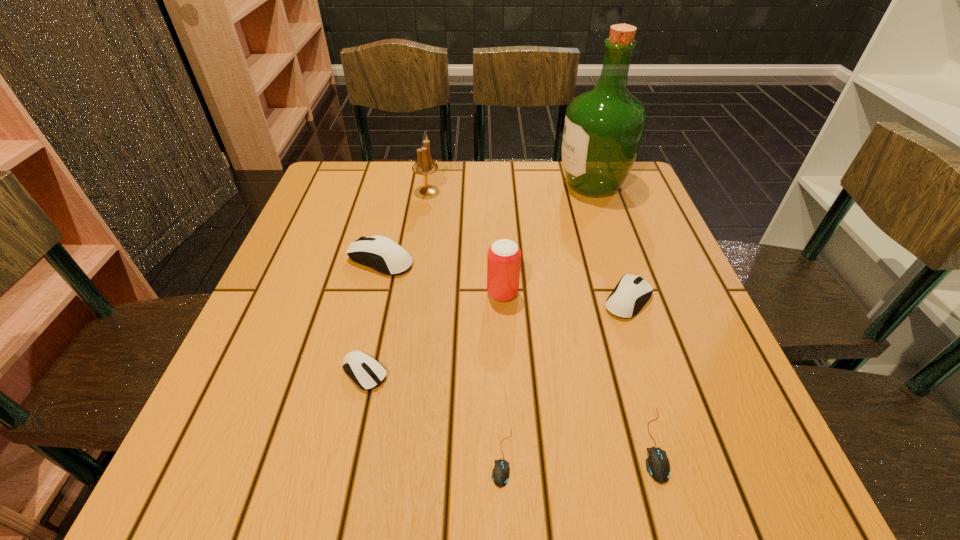
You are a GUI agent. You are given a task and a screenshot of the screen. Output one action in this format:
    pyautogui.click(x=<x>, y=<y>)
    Task: Click on the third nearest mouse
    
    Given the screenshot: What is the action you would take?
    pyautogui.click(x=367, y=373)

The image size is (960, 540). Identify the location of the seventh tallest object. (657, 464).

The height and width of the screenshot is (540, 960). In order to click on the right black mouse in this screenshot , I will do `click(657, 464)`.

Locate an element on the screen. This screenshot has height=540, width=960. the left black mouse is located at coordinates (500, 474).

This screenshot has height=540, width=960. In order to click on the shortest object in this screenshot , I will do `click(500, 474)`.

Where is `vacant space located on the front-facing side of the tallest object`? This screenshot has height=540, width=960. vacant space located on the front-facing side of the tallest object is located at coordinates 515,185.

The height and width of the screenshot is (540, 960). Identify the location of vacant position located on the front-facing side of the tallest object. (526, 185).

I want to click on vacant point located 0.270m on the front-facing side of the tallest object, so click(x=454, y=185).

In order to click on vacant space located on the right of the candle holder in this screenshot , I will do `click(586, 191)`.

You are a GUI agent. You are given a task and a screenshot of the screen. Output one action in this format:
    pyautogui.click(x=<x>, y=<y>)
    Task: Click on the vacant space situated on the left of the third tallest object
    
    Given the screenshot: What is the action you would take?
    pyautogui.click(x=387, y=293)